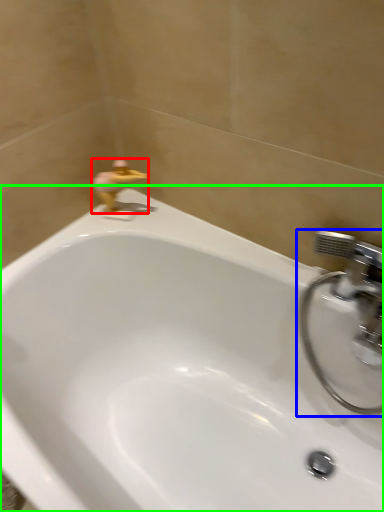
Question: Which object is the farthest from plumbing fixture (highlighted by a red box)? Choose among these: tap (highlighted by a blue box) or bathtub (highlighted by a green box).

Choices:
 (A) tap
 (B) bathtub

Answer: (A)